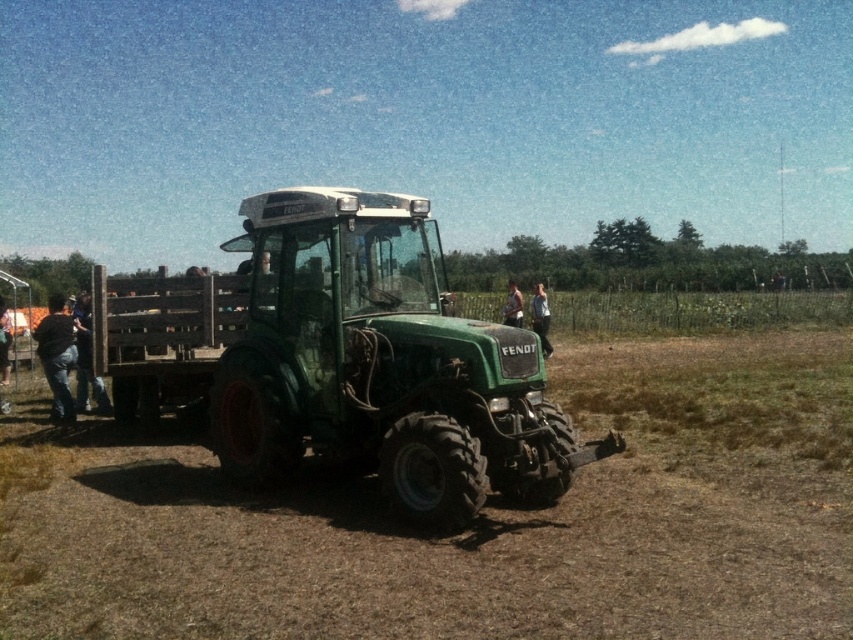
You are a farmer who wants to store your light brown leather jacket at center in the trunk of your green matte tractor at center. Based on the scene description, will the jacket fit inside the trunk?

The green matte tractor at center occupies less space than light brown leather jacket at center, so the jacket will not fit inside the tractor trunk as it is larger.

You are a farmer standing in the middle of the field. You see the dull brown dirt at center and the light brown leather jacket at center. Which object is closer to the ground?

The dull brown dirt at center is closer to the ground since it has a lesser height compared to the light brown leather jacket at center.